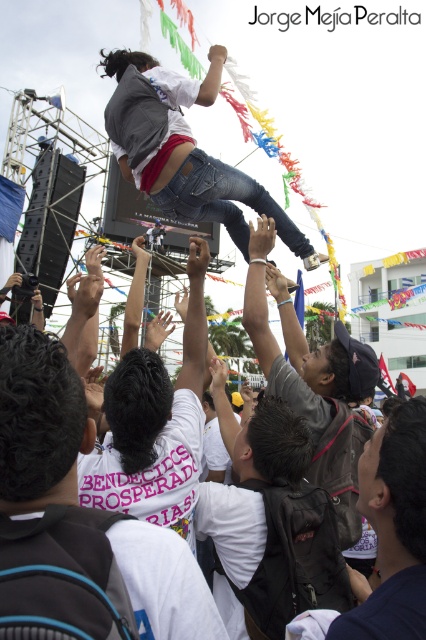
You are standing in the crowd watching the celebration. There is a person in a dark blue shirt at lower right. Can you reach them with a 30 meter long megaphone?

The dark blue shirt at lower right is 35.18 meters away from you, so the 30 meter long megaphone is not long enough to reach them.

You are a photographer standing at the edge of the crowd. You want to take a photo of the person being lifted into the air. However, there are two obstacles in your path to the best vantage point. The first obstacle is the dark blue shirt at lower right, and the second is the dark gray leather jacket at center. Given the distance between them, can you navigate around both obstacles to reach the optimal spot without getting too close to either?

The distance between the dark blue shirt at lower right and dark gray leather jacket at center is 14.01 meters, so yes, you can navigate around both obstacles to reach the optimal spot while maintaining a safe distance from each.